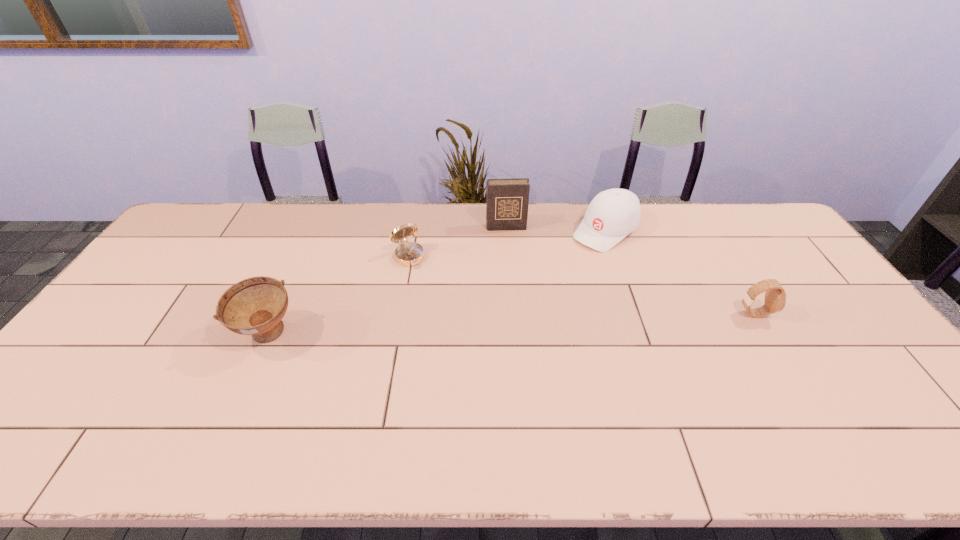
What are the coordinates of `blank area located with the dial facing the fourth object from right to left` in the screenshot? It's located at (453, 323).

Find the location of a particular element. Image resolution: width=960 pixels, height=540 pixels. vacant space located on the front-facing side of the baseball cap is located at coordinates (568, 260).

This screenshot has height=540, width=960. I want to click on vacant point located on the front-facing side of the baseball cap, so click(525, 295).

This screenshot has height=540, width=960. In order to click on blank space located on the front-facing side of the baseball cap in this screenshot , I will do `click(563, 265)`.

Locate an element on the screen. The height and width of the screenshot is (540, 960). free point located on the front cover of the tallest object is located at coordinates (512, 269).

Find the location of a particular element. vacant space located 0.260m on the front cover of the tallest object is located at coordinates (514, 282).

I want to click on free location located 0.210m on the front cover of the tallest object, so click(x=513, y=271).

Where is `baseball cap present at the far edge`? This screenshot has height=540, width=960. baseball cap present at the far edge is located at coordinates (613, 214).

Where is `diary located in the far edge section of the desktop`? This screenshot has height=540, width=960. diary located in the far edge section of the desktop is located at coordinates (507, 200).

Image resolution: width=960 pixels, height=540 pixels. In order to click on free space at the far edge of the desktop in this screenshot , I will do `click(358, 230)`.